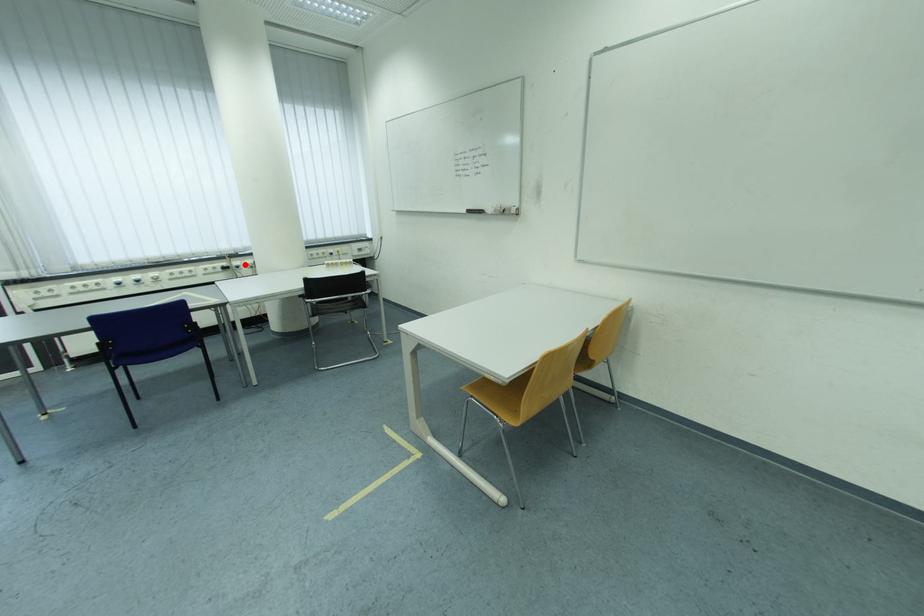
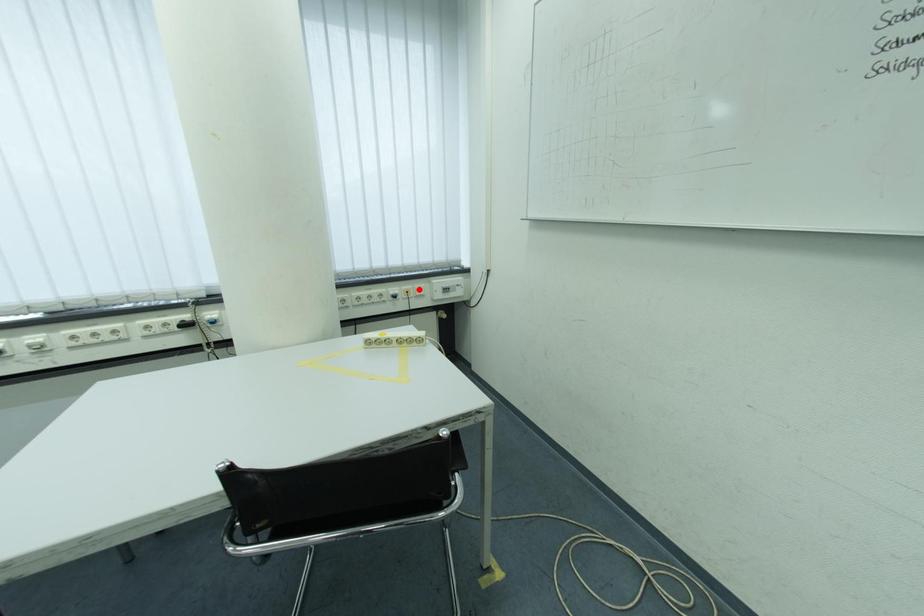
I am providing you with two images of the same scene from different viewpoints. A red point is marked on the first image and another point is marked on the second image. Do the highlighted points in image1 and image2 indicate the same real-world spot?

No